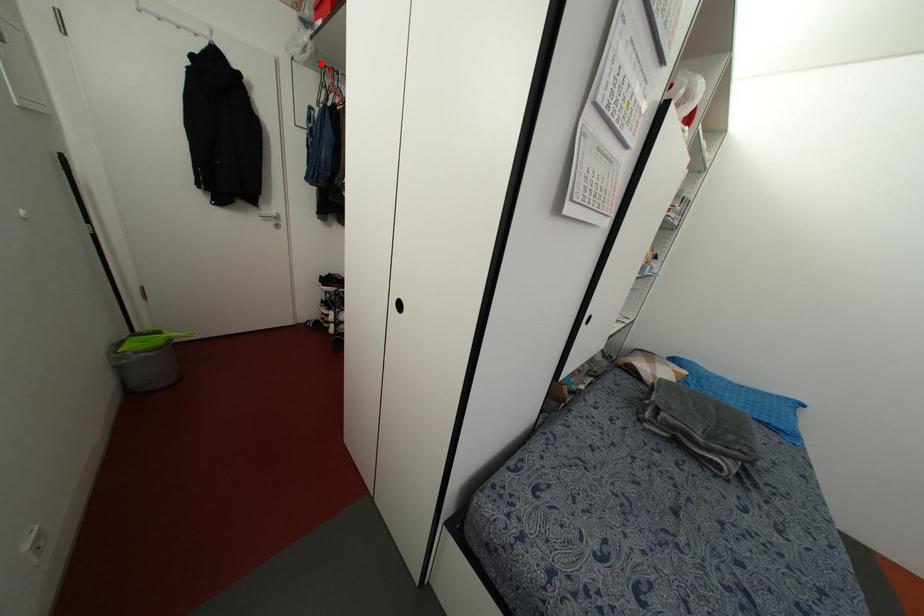
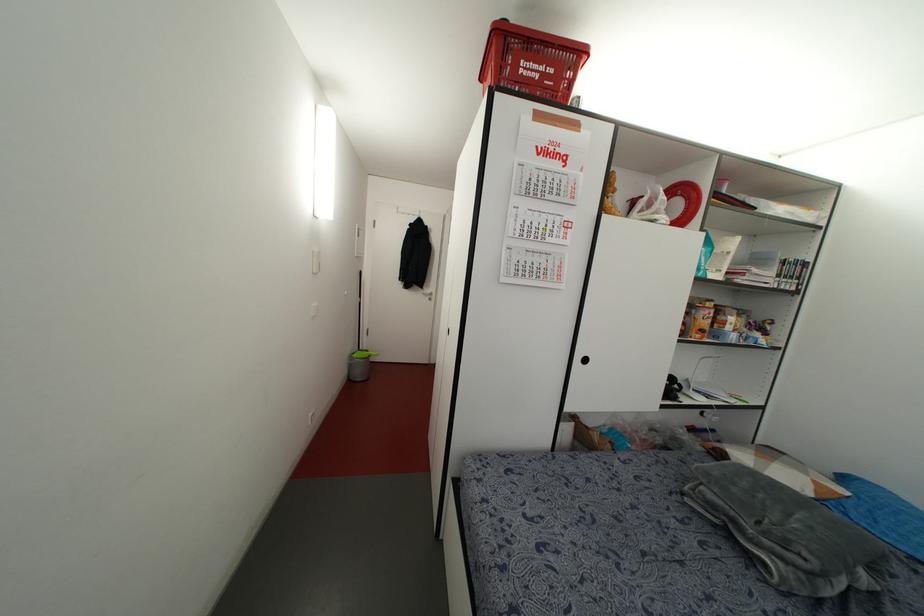
Question: I am providing you with two images of the same scene from different viewpoints. A red point is marked on the first image. Is the red point's position out of view in image 2?

Choices:
 (A) Yes
 (B) No

Answer: (A)